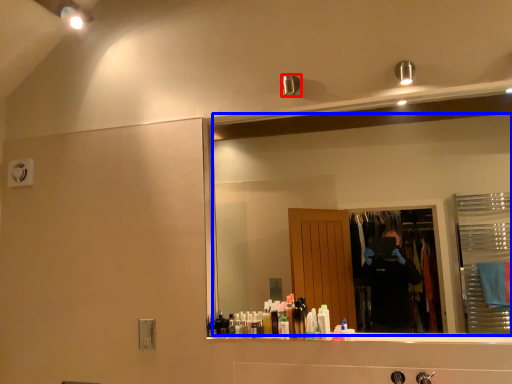
Question: Among these objects, which one is farthest to the camera, shower (highlighted by a red box) or mirror (highlighted by a blue box)?

Choices:
 (A) shower
 (B) mirror

Answer: (A)